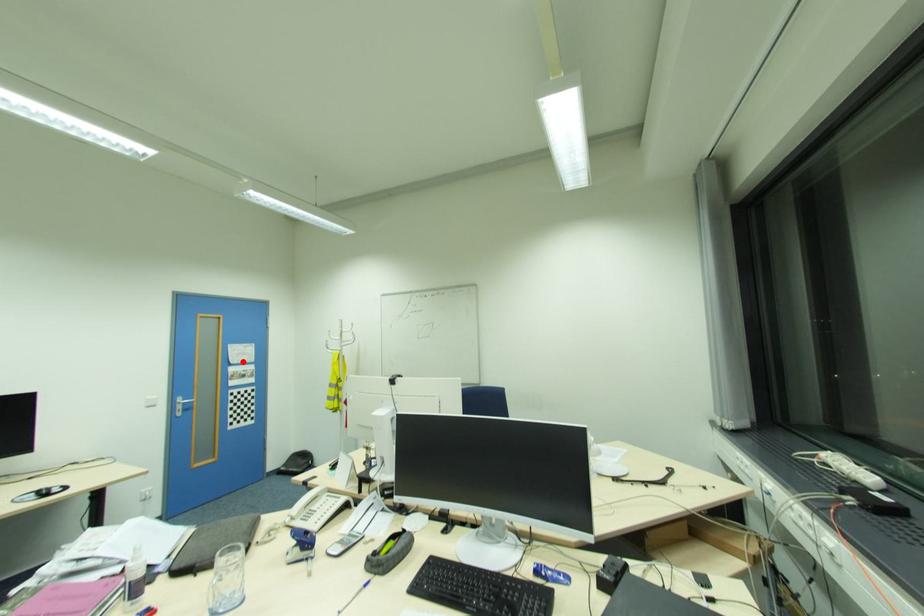
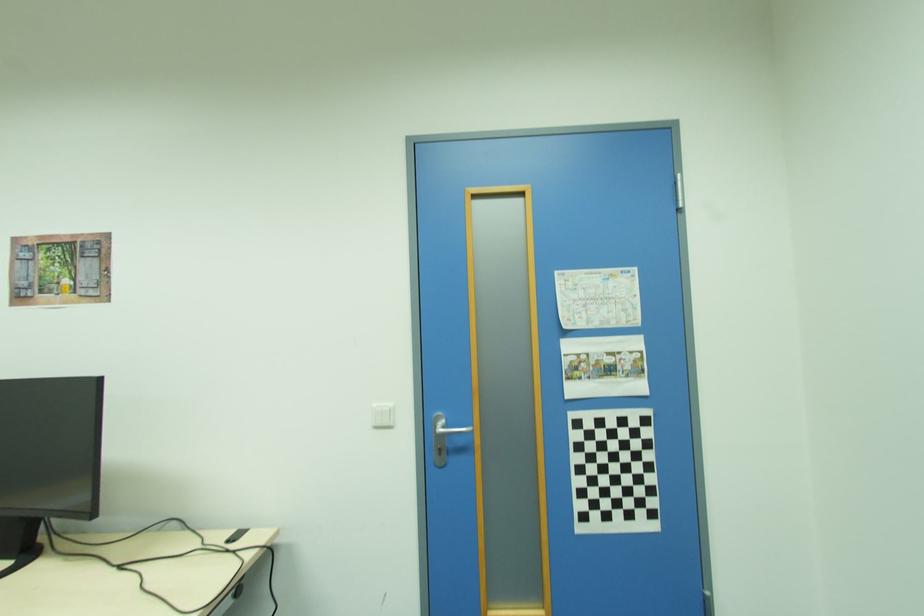
The point at the highlighted location is marked in the first image. Where is the corresponding point in the second image?

(599, 325)